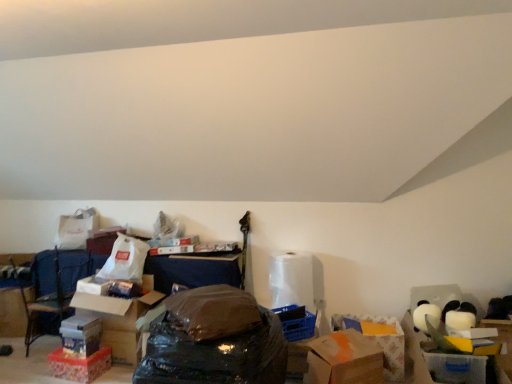
Question: Is brown cardboard box at lower right taller or shorter than white matte toilet paper at center?

Choices:
 (A) tall
 (B) short

Answer: (B)

Question: Based on their sizes in the image, would you say brown cardboard box at lower right is bigger or smaller than white matte toilet paper at center?

Choices:
 (A) small
 (B) big

Answer: (B)

Question: Which of these objects is positioned closest to the white matte toilet paper at center?

Choices:
 (A) translucent plastic storage box at lower right, the first storage box viewed from the front
 (B) translucent plastic storage box at lower left, which ranks as the third storage box in right-to-left order
 (C) brown plastic bag at center
 (D) brown cardboard box at lower right
 (E) blue fabric armchair at lower left

Answer: (D)

Question: Based on their relative distances, which object is nearer to the white matte toilet paper at center?

Choices:
 (A) matte cardboard box at lower left, which ranks as the first storage box in back-to-front order
 (B) blue fabric armchair at lower left
 (C) orange matte cardboard box at center, which is the first cardboard box from right to left
 (D) translucent plastic storage box at lower right, the first storage box viewed from the front
 (E) brown plastic bag at center

Answer: (C)